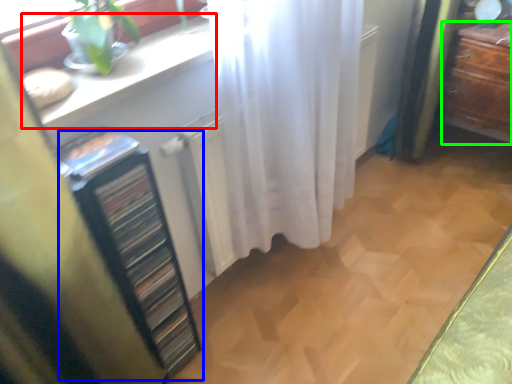
Question: Considering the real-world distances, which object is closest to counter top (highlighted by a red box)? file cabinet (highlighted by a blue box) or furniture (highlighted by a green box).

Choices:
 (A) file cabinet
 (B) furniture

Answer: (A)